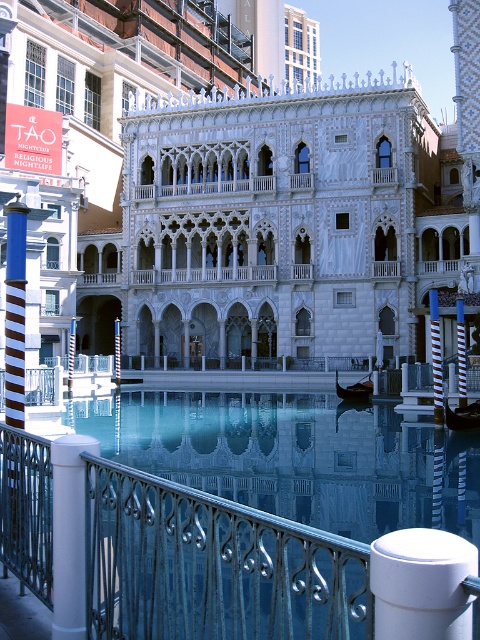
The width and height of the screenshot is (480, 640). Find the location of `blue-green wrought iron railing at lower center`. blue-green wrought iron railing at lower center is located at coordinates (212, 566).

Describe the element at coordinates (212, 566) in the screenshot. The width and height of the screenshot is (480, 640). I see `blue-green wrought iron railing at lower center` at that location.

Between point (334, 632) and point (60, 525), which one is positioned in front?

Positioned in front is point (334, 632).

The image size is (480, 640). What are the coordinates of `blue-green wrought iron railing at lower center` in the screenshot? It's located at (212, 566).

Does white marble palace at center have a greater width compared to white matte/porcelain pillar at lower left?

Yes.

Is point (169, 26) farther from camera compared to point (84, 625)?

Yes, point (169, 26) is farther from viewer.

Where is `white marble palace at center`? This screenshot has width=480, height=640. white marble palace at center is located at coordinates (239, 195).

Is point (37, 216) closer to camera compared to point (220, 609)?

No, it is behind (220, 609).

Who is shorter, white marble palace at center or blue-green wrought iron railing at lower center?

blue-green wrought iron railing at lower center

Does point (197, 13) lie behind point (187, 564)?

Yes, it is.

Image resolution: width=480 pixels, height=640 pixels. I want to click on white marble palace at center, so point(239,195).